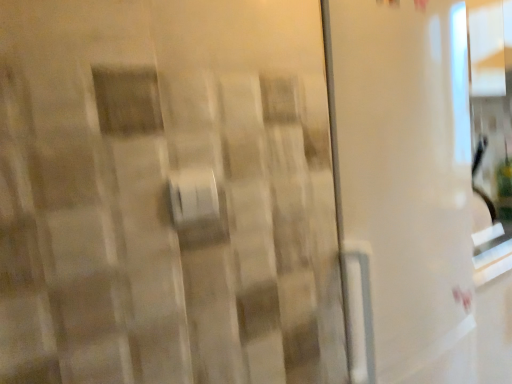
Question: Is white plastic towel bar at center inside or outside of transparent plastic screen door at center?

Choices:
 (A) outside
 (B) inside

Answer: (A)

Question: Looking at the image, does white plastic towel bar at center seem bigger or smaller compared to transparent plastic screen door at center?

Choices:
 (A) big
 (B) small

Answer: (B)

Question: From the image's perspective, is white plastic towel bar at center positioned above or below transparent plastic screen door at center?

Choices:
 (A) below
 (B) above

Answer: (B)

Question: From the image's perspective, is transparent plastic screen door at center above or below white plastic towel bar at center?

Choices:
 (A) below
 (B) above

Answer: (A)

Question: Is point (418, 307) positioned closer to the camera than point (173, 195)?

Choices:
 (A) closer
 (B) farther

Answer: (B)

Question: Is transparent plastic screen door at center bigger or smaller than white plastic towel bar at center?

Choices:
 (A) big
 (B) small

Answer: (A)

Question: Is transparent plastic screen door at center taller or shorter than white plastic towel bar at center?

Choices:
 (A) tall
 (B) short

Answer: (A)